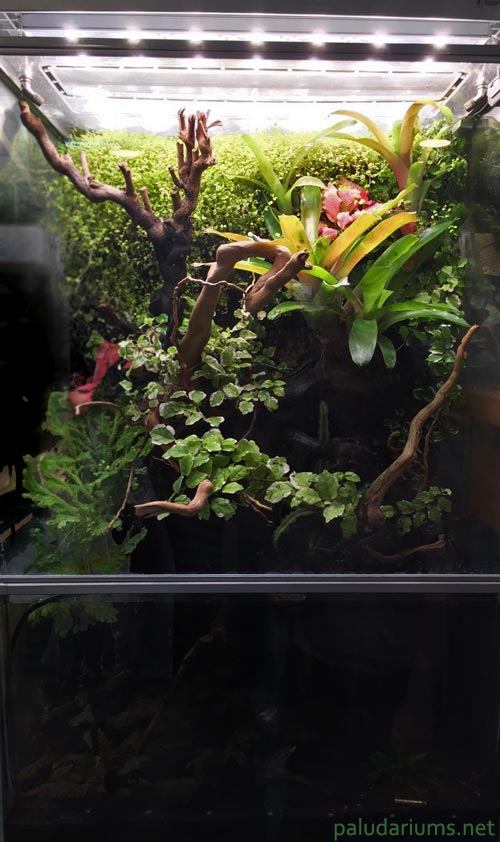
Identify the location of plant in background with small leaves. (152, 157), (222, 196).